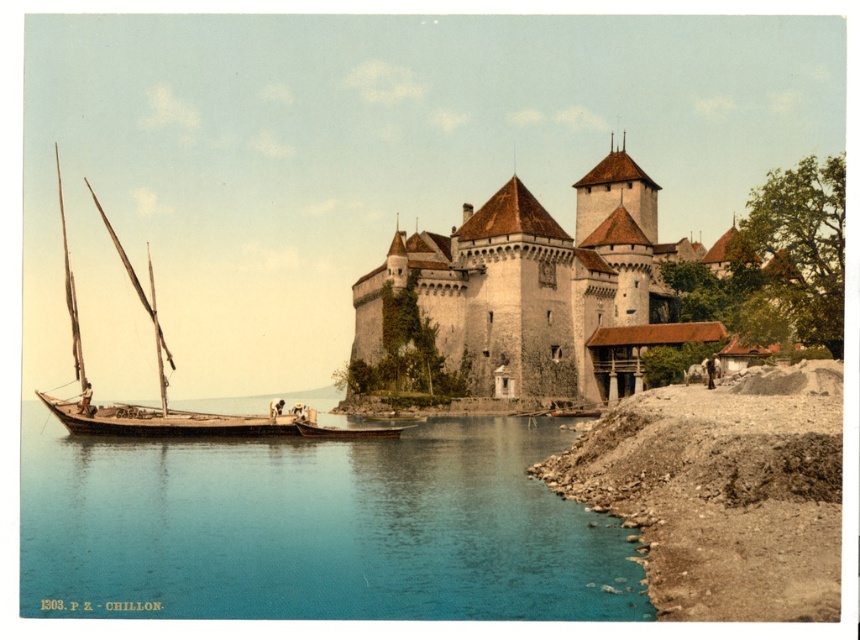
You are standing on the brown gravel shore at lower right and want to reach the blue water at lower left. Which direction should you move to get there?

You should move towards the lower left direction to reach the blue water at lower left from the brown gravel shore at lower right.

You are standing at the edge of the brown gravel shore at lower right and want to walk to the white stone castle at center. Which direction should you head towards to reach the castle?

To reach the white stone castle at center from the brown gravel shore at lower right, you should head towards the center of the image, as the castle is positioned centrally and the shore is on the right side.

You are standing at the center of Chillon Castle looking towards the lake. Which direction should you walk to reach the blue water at lower left?

You should walk towards the lower left direction to reach the blue water at lower left since it is located at point (314, 529).